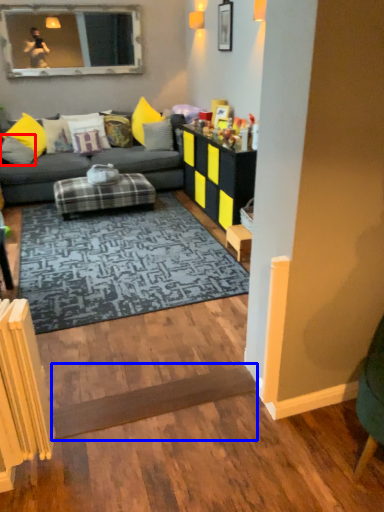
Question: Which object appears closest to the camera in this image, pillow (highlighted by a red box) or plank (highlighted by a blue box)?

Choices:
 (A) pillow
 (B) plank

Answer: (B)